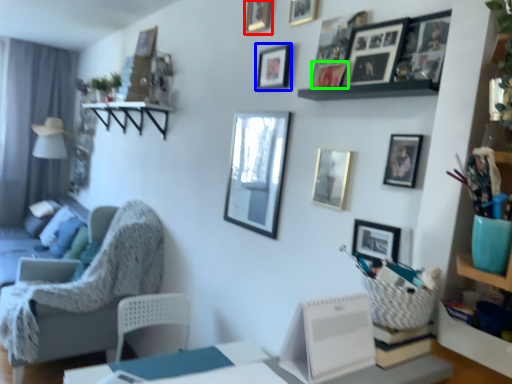
Question: Estimate the real-world distances between objects in this image. Which object is farther from picture frame (highlighted by a red box), picture frame (highlighted by a blue box) or picture frame (highlighted by a green box)?

Choices:
 (A) picture frame
 (B) picture frame

Answer: (B)